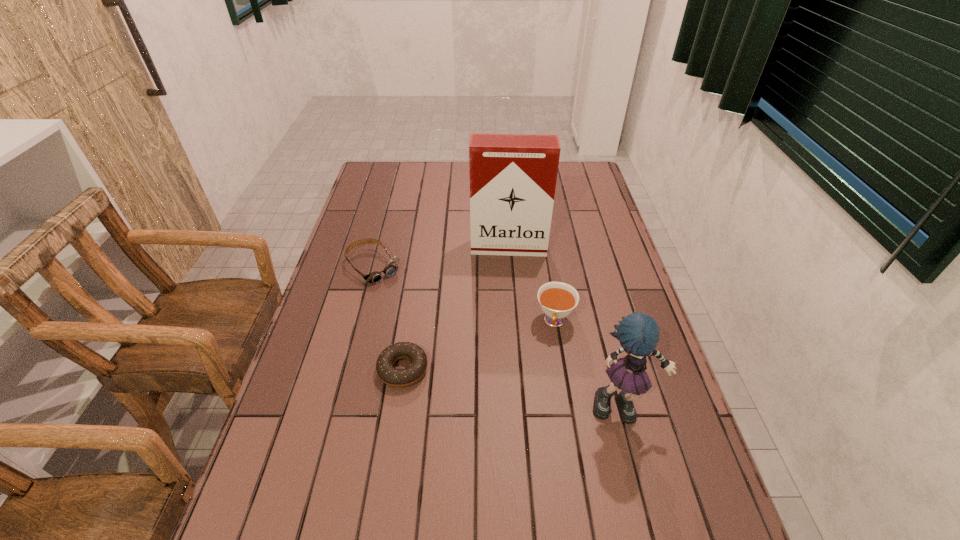
Where is `free spot on the desktop that is between the shortest object and the rag doll and is positioned on the side of the third tallest object with the handle`? Image resolution: width=960 pixels, height=540 pixels. free spot on the desktop that is between the shortest object and the rag doll and is positioned on the side of the third tallest object with the handle is located at coordinates (540, 393).

Find the location of a particular element. The width and height of the screenshot is (960, 540). vacant space on the desktop that is between the shortest object and the fourth shortest object and is positioned on the front-facing side of the tallest object is located at coordinates (509, 388).

At what (x,y) coordinates should I click in order to perform the action: click on vacant space on the desktop that is between the doughnut and the fourth shortest object and is positioned on the front-facing side of the second shortest object. Please return your answer as a coordinate pair (x, y). Looking at the image, I should click on (480, 383).